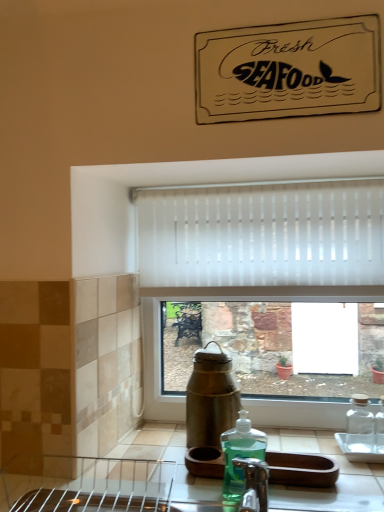
Question: From a real-world perspective, relative to white translucent blinds at center, is green translucent liquid soap at lower center vertically above or below?

Choices:
 (A) above
 (B) below

Answer: (B)

Question: Is green translucent liquid soap at lower center wider or thinner than white translucent blinds at center?

Choices:
 (A) thin
 (B) wide

Answer: (B)

Question: Considering the positions of point (246, 433) and point (279, 250), is point (246, 433) closer or farther from the camera than point (279, 250)?

Choices:
 (A) farther
 (B) closer

Answer: (B)

Question: From the image's perspective, relative to green translucent liquid soap at lower center, is white translucent blinds at center above or below?

Choices:
 (A) above
 (B) below

Answer: (A)

Question: Considering the positions of white translucent blinds at center and green translucent liquid soap at lower center in the image, is white translucent blinds at center wider or thinner than green translucent liquid soap at lower center?

Choices:
 (A) wide
 (B) thin

Answer: (B)

Question: Is point (380, 241) positioned closer to the camera than point (243, 432)?

Choices:
 (A) closer
 (B) farther

Answer: (B)

Question: From a real-world perspective, is white translucent blinds at center positioned above or below green translucent liquid soap at lower center?

Choices:
 (A) above
 (B) below

Answer: (A)